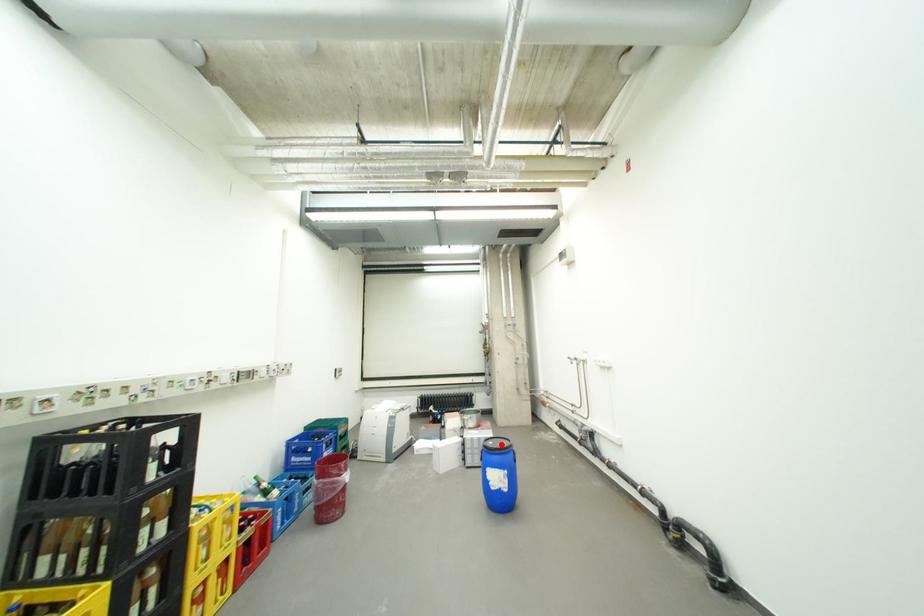
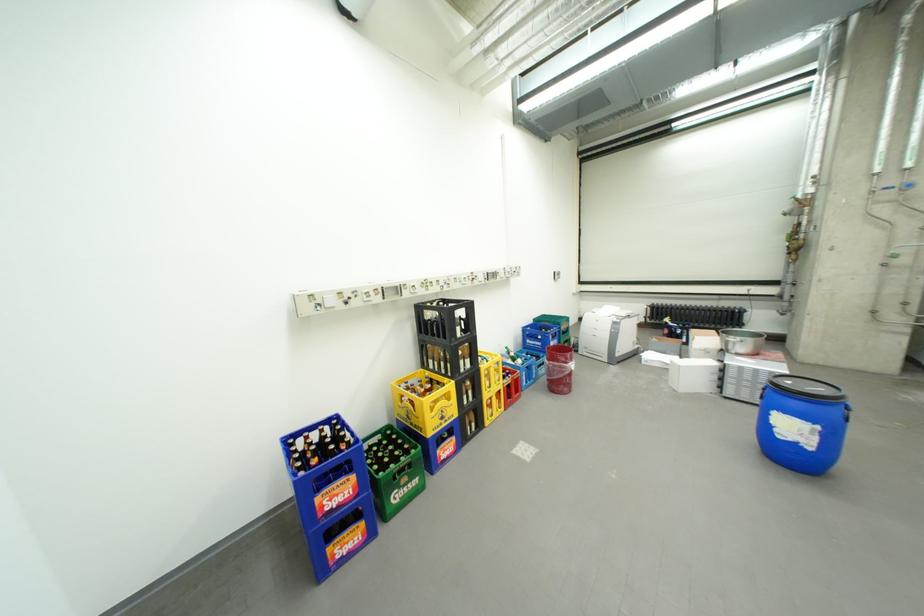
Locate, in the second image, the point that corresponds to the highlighted location in the first image.

(799, 383)